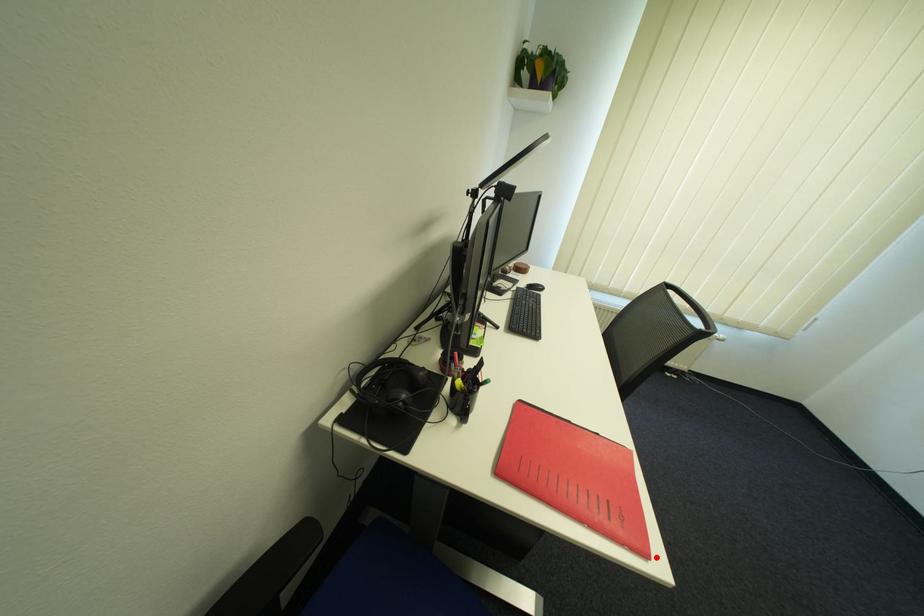
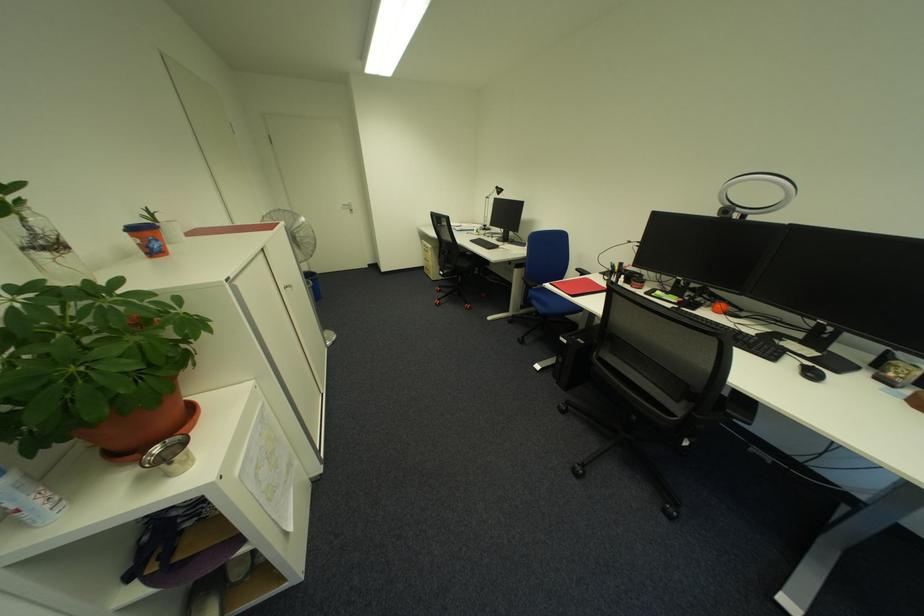
Question: I am providing you with two images of the same scene from different viewpoints. In image1, a red point is highlighted. Considering the same 3D point in image2, which of the following is correct?

Choices:
 (A) It is closer
 (B) It is farther

Answer: (A)